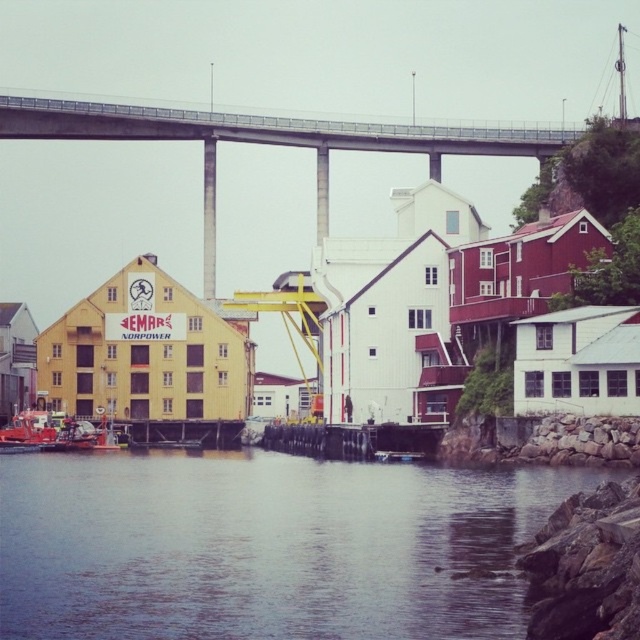
Between smooth water at lower center and concrete bridge at upper center, which one has more height?

concrete bridge at upper center

Can you confirm if smooth water at lower center is positioned below concrete bridge at upper center?

Yes.

Find the location of `smooth water at lower center`. smooth water at lower center is located at coordinates (266, 547).